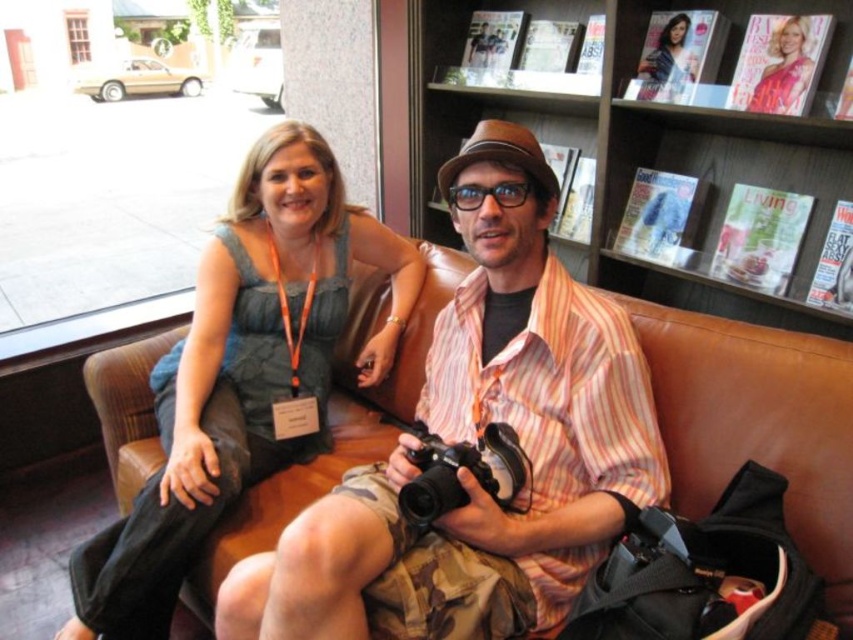
Question: Which object is positioned farthest from the blonde hair at upper right?

Choices:
 (A) matte green dress at center
 (B) brown leather couch at center

Answer: (A)

Question: Does matte green dress at center appear on the right side of brown leather couch at center?

Choices:
 (A) no
 (B) yes

Answer: (A)

Question: Does wooden bookshelf at upper right appear on the left side of blonde hair at upper right?

Choices:
 (A) yes
 (B) no

Answer: (A)

Question: Among these points, which one is nearest to the camera?

Choices:
 (A) (138, 484)
 (B) (425, 42)
 (C) (798, 84)

Answer: (C)

Question: Which of the following is the closest to the observer?

Choices:
 (A) blonde hair at upper right
 (B) brown leather couch at center
 (C) wooden bookshelf at upper right
 (D) matte green dress at center

Answer: (D)

Question: Does wooden bookshelf at upper right appear on the right side of blonde hair at upper right?

Choices:
 (A) no
 (B) yes

Answer: (A)